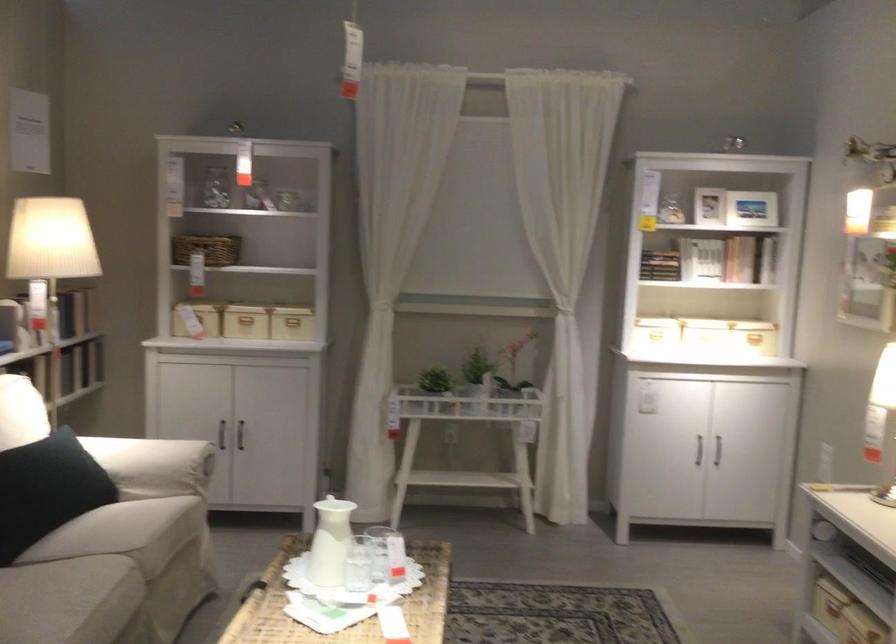
Image resolution: width=896 pixels, height=644 pixels. Find the location of `sofa sitting surface`. sofa sitting surface is located at coordinates (110, 576).